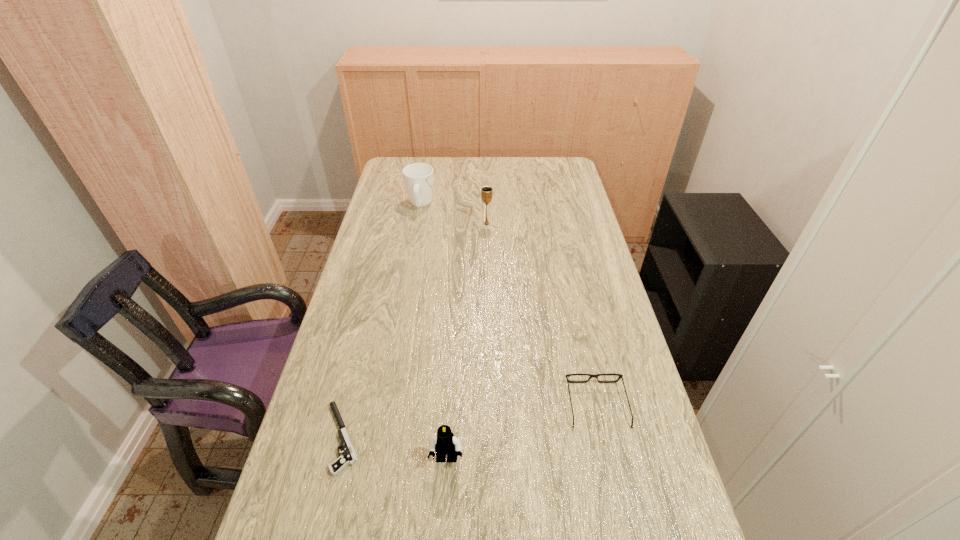
Locate an element on the screen. vacant area at the left edge is located at coordinates (388, 229).

In order to click on free space at the right edge of the desktop in this screenshot , I will do `click(563, 291)`.

This screenshot has height=540, width=960. In order to click on vacant point at the far right corner in this screenshot , I will do pyautogui.click(x=554, y=167).

You are a GUI agent. You are given a task and a screenshot of the screen. Output one action in this format:
    pyautogui.click(x=<x>, y=<y>)
    Task: Click on the free space that is in between the mug and the pistol
    This screenshot has height=540, width=960.
    Given the screenshot: What is the action you would take?
    pyautogui.click(x=381, y=321)

This screenshot has height=540, width=960. Identify the location of vacant region between the chalice and the mug. (453, 214).

Find the location of `free space between the farthest object and the shortest object`. free space between the farthest object and the shortest object is located at coordinates (381, 321).

Identify the location of vacant area between the third tallest object and the pistol. (395, 449).

You are a GUI agent. You are given a task and a screenshot of the screen. Output one action in this format:
    pyautogui.click(x=<x>, y=<y>)
    Task: Click on the empty location between the spectacles and the pistol
    
    Given the screenshot: What is the action you would take?
    pyautogui.click(x=469, y=421)

The height and width of the screenshot is (540, 960). What are the coordinates of `blank region between the shortest object and the mug` in the screenshot? It's located at (381, 321).

The image size is (960, 540). I want to click on free space between the fourth object from left to right and the mug, so tap(453, 214).